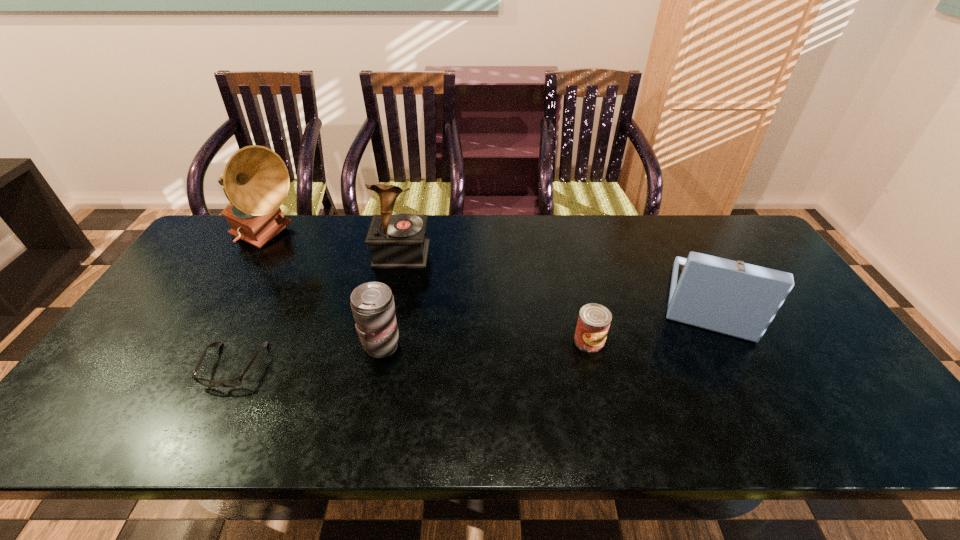
At what (x,y) coordinates should I click in order to perform the action: click on vacant area at the near edge. Please return your answer as a coordinate pair (x, y). Looking at the image, I should click on (536, 422).

Identify the location of vacant position at the left edge of the desktop. The image size is (960, 540). tap(161, 340).

In the image, there is a desktop. Where is `vacant space at the right edge`? Image resolution: width=960 pixels, height=540 pixels. vacant space at the right edge is located at coordinates (795, 382).

The height and width of the screenshot is (540, 960). In order to click on blank space at the far right corner of the desktop in this screenshot , I will do `click(736, 230)`.

In order to click on vacant point located between the telephoto lens and the shortest phonograph record in this screenshot , I will do `click(546, 323)`.

Image resolution: width=960 pixels, height=540 pixels. Identify the location of free space between the shortest object and the telephoto lens. pyautogui.click(x=308, y=356).

Find the location of `free spot between the second tallest phonograph record and the spectacles`. free spot between the second tallest phonograph record and the spectacles is located at coordinates (318, 310).

Locate an element on the screen. The image size is (960, 540). free space between the rightmost phonograph record and the leftmost phonograph record is located at coordinates (489, 270).

Locate an element on the screen. The image size is (960, 540). vacant space that is in between the leftmost phonograph record and the spectacles is located at coordinates (250, 302).

The width and height of the screenshot is (960, 540). Find the location of `free space between the shortest phonograph record and the third shortest object`. free space between the shortest phonograph record and the third shortest object is located at coordinates (546, 323).